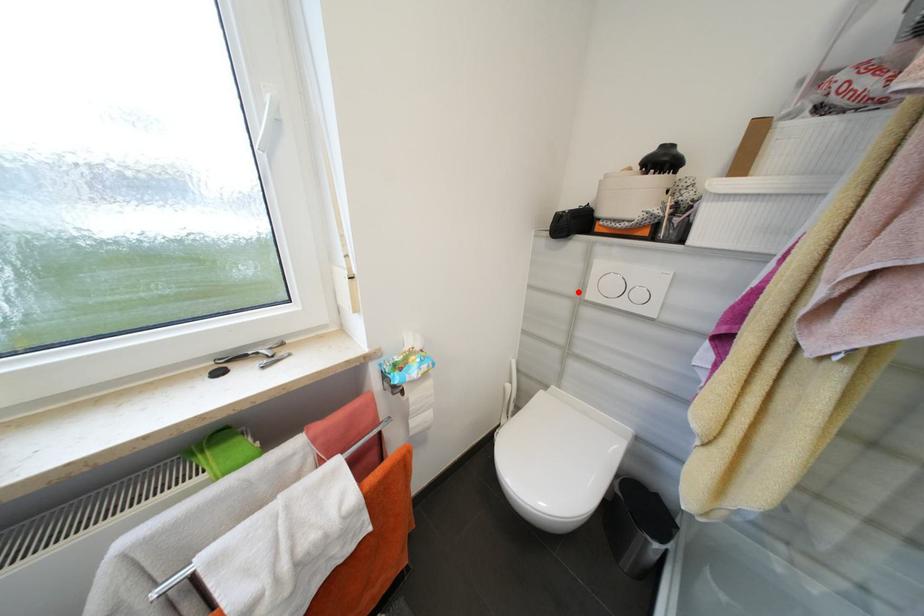
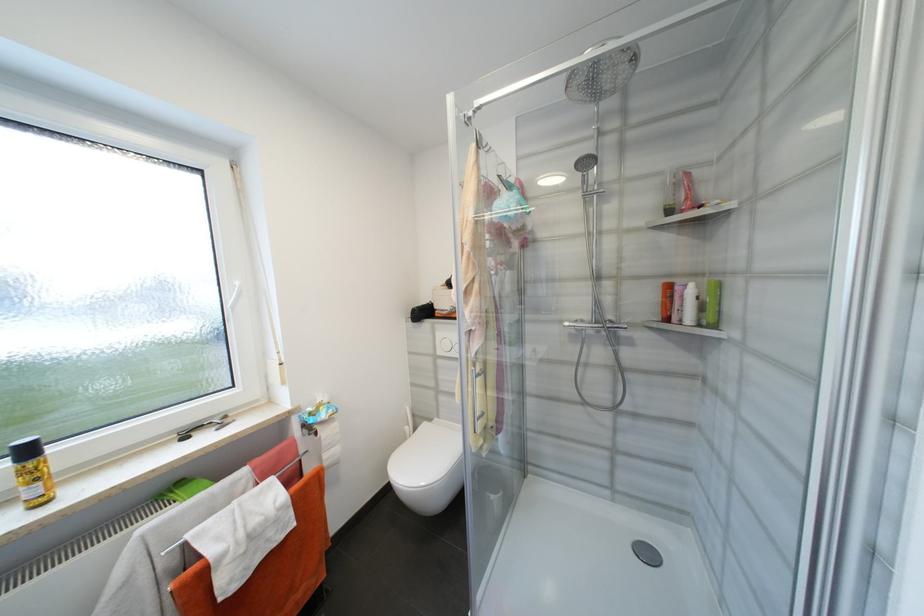
Locate, in the second image, the point that corresponds to the highlighted location in the first image.

(436, 352)